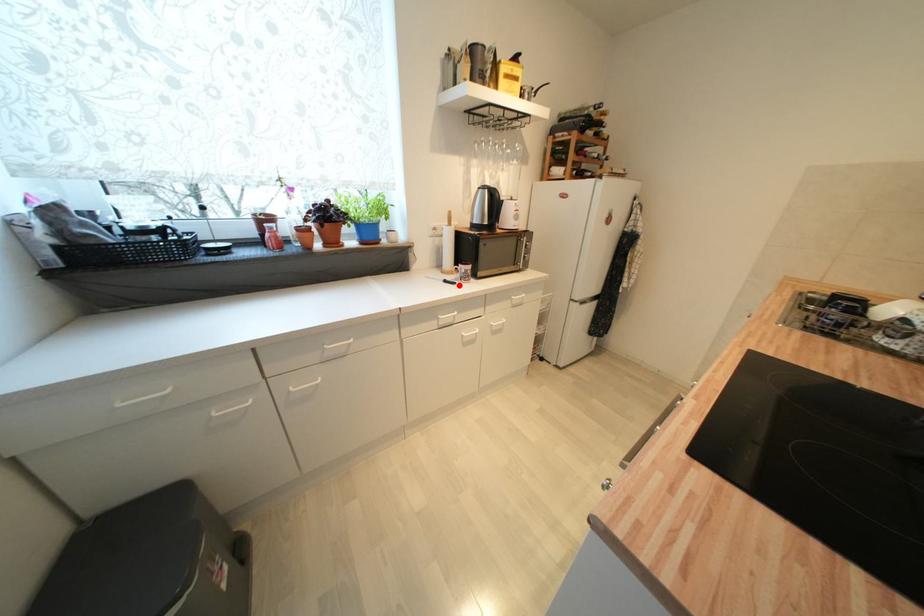
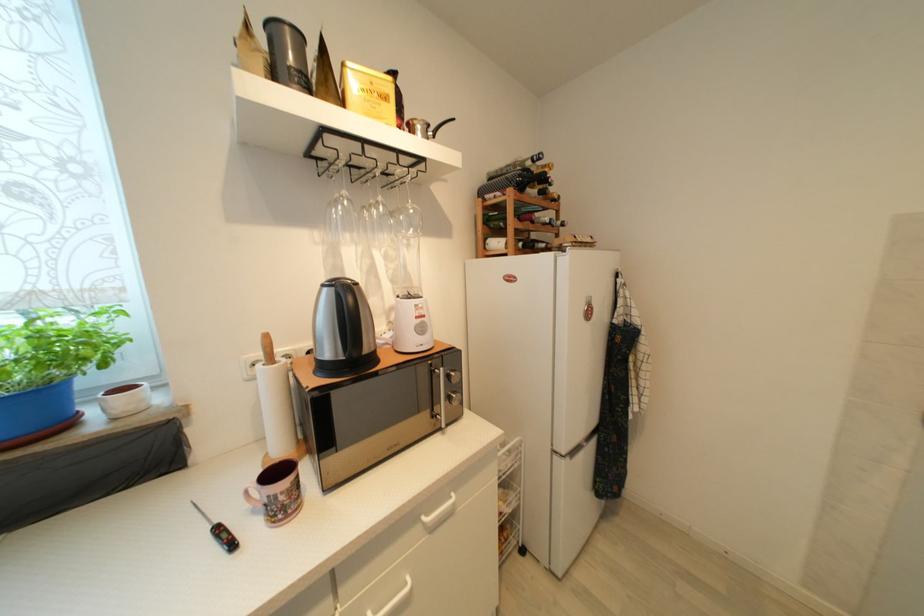
Question: I am providing you with two images of the same scene from different viewpoints. A red point is marked on the first image. Is the red point's position out of view in image 2?

Choices:
 (A) Yes
 (B) No

Answer: (B)